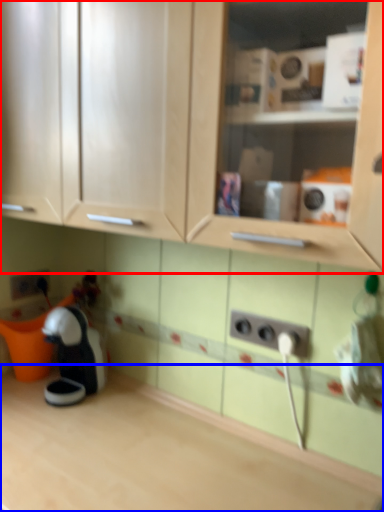
Question: Which object is further to the camera taking this photo, cabinetry (highlighted by a red box) or countertop (highlighted by a blue box)?

Choices:
 (A) cabinetry
 (B) countertop

Answer: (B)